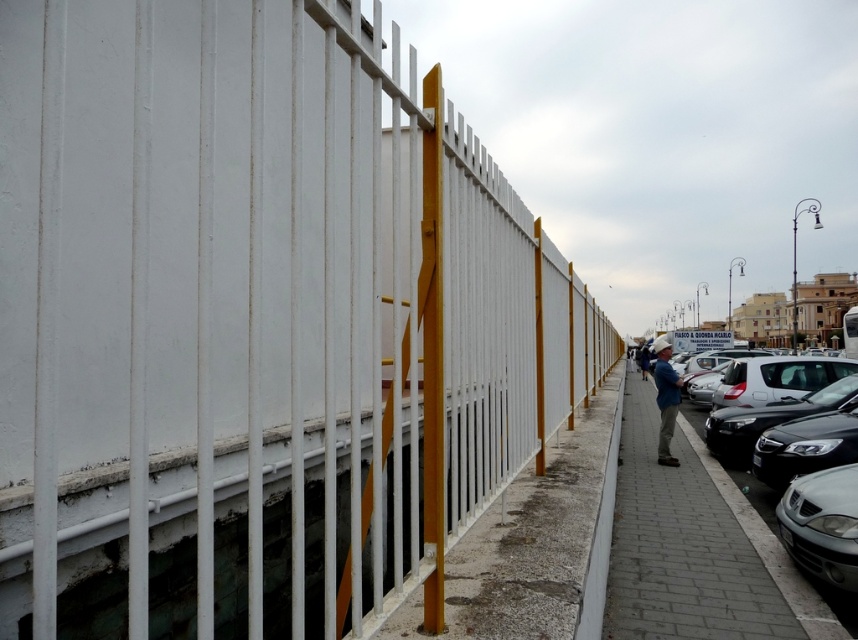
Question: Which point is closer to the camera?

Choices:
 (A) (198, 369)
 (B) (680, 380)
 (C) (625, 404)
 (D) (856, 544)

Answer: (A)

Question: Does white plastic fence at center appear over matte silver car at lower right?

Choices:
 (A) yes
 (B) no

Answer: (A)

Question: Which of these objects is positioned farthest from the matte silver car at lower right?

Choices:
 (A) concrete at center
 (B) gray concrete sidewalk at center
 (C) blue fabric shirt at center-right

Answer: (C)

Question: Is concrete at center smaller than blue fabric shirt at center-right?

Choices:
 (A) yes
 (B) no

Answer: (A)

Question: Does matte silver car at lower right have a larger size compared to blue fabric shirt at center-right?

Choices:
 (A) no
 (B) yes

Answer: (A)

Question: Which point is farther to the camera?

Choices:
 (A) pos(829,460)
 (B) pos(627,481)
 (C) pos(665,352)
 (D) pos(553,536)

Answer: (C)